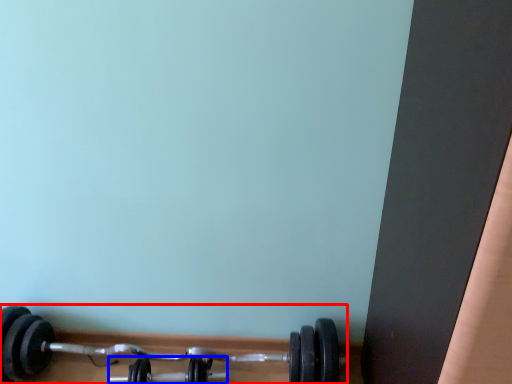
Question: Which of the following is the farthest to the observer, dumbbell (highlighted by a red box) or dumbbell (highlighted by a blue box)?

Choices:
 (A) dumbbell
 (B) dumbbell

Answer: (B)